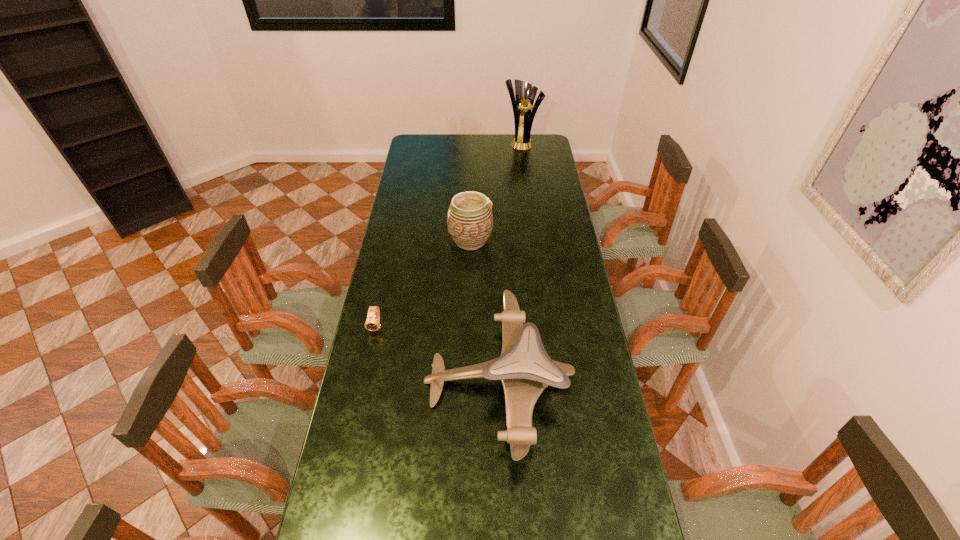
Where is `free space in the image that satisfies the following two spatial constraints: 1. at the front of the farthest object, where the globe is visible; 2. on the front-facing side of the third tallest object`? free space in the image that satisfies the following two spatial constraints: 1. at the front of the farthest object, where the globe is visible; 2. on the front-facing side of the third tallest object is located at coordinates [554, 381].